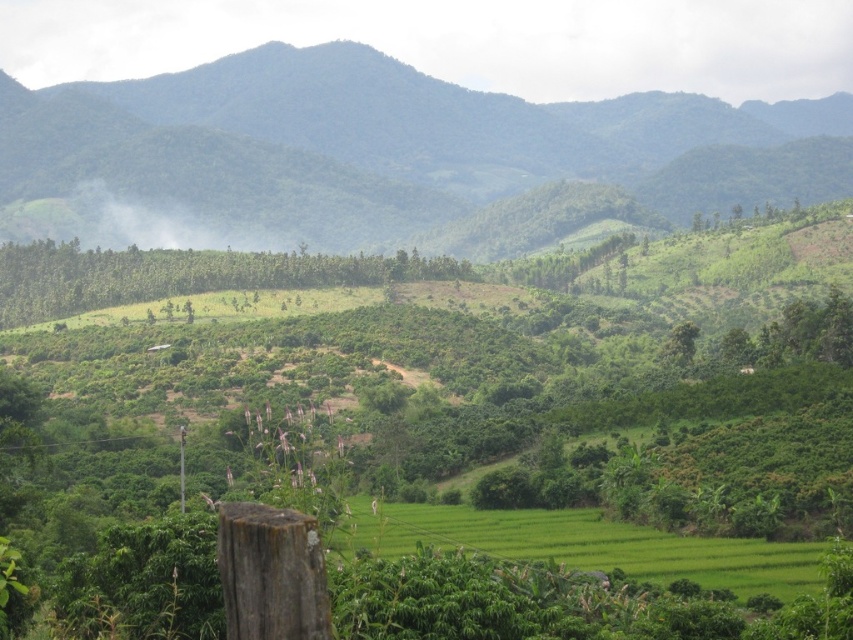
You are a hiker planning to walk from the green grassy field at center to the green leafy mountain at center. Based on the distance between them, can you estimate how long it would take to reach the mountain if you walk at a moderate pace of 3 km per hour?

The green leafy mountain at center is 484.30 meters away from the green grassy field at center. At a moderate walking pace of 3 km per hour, it would take approximately 9.7 minutes to reach the mountain.

You are standing in the lush landscape and want to take a photo of the green leafy mountain at center and the green grassy field at center. Which object should you point your camera upwards to capture?

You should point your camera upwards to capture the green leafy mountain at center because it is positioned above the green grassy field at center.

Looking at this image, you are standing in the lush landscape and want to determine which object is higher between the green leafy mountain at center and the green grassy field at center. Based on the scene, which one is taller?

The green leafy mountain at center is taller than the green grassy field at center.